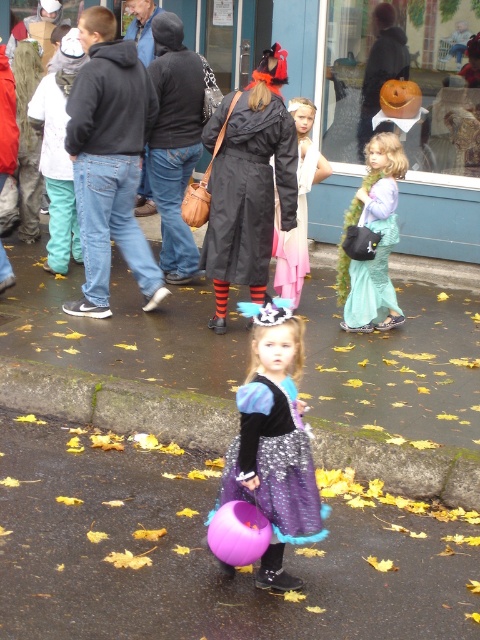
Question: Can you confirm if sparkly purple dress at center is positioned to the left of teal satin dress at right?

Choices:
 (A) no
 (B) yes

Answer: (B)

Question: Does sparkly purple dress at center have a smaller size compared to teal satin dress at right?

Choices:
 (A) yes
 (B) no

Answer: (A)

Question: Among these points, which one is nearest to the camera?

Choices:
 (A) (386, 220)
 (B) (286, 525)

Answer: (B)

Question: Among these objects, which one is farthest from the camera?

Choices:
 (A) sparkly purple dress at center
 (B) teal satin dress at right

Answer: (B)

Question: Does sparkly purple dress at center have a larger size compared to teal satin dress at right?

Choices:
 (A) no
 (B) yes

Answer: (A)